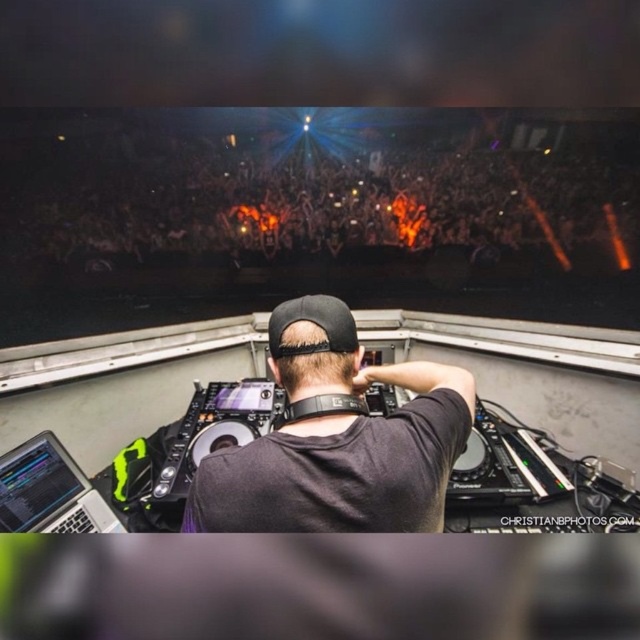
Is black matte shirt at center positioned before silver/black laptop at lower left?

Yes, it is in front of silver/black laptop at lower left.

Who is more forward, (292, 332) or (12, 506)?

Positioned in front is point (292, 332).

Between point (292, 486) and point (65, 477), which one is positioned behind?

The point (65, 477) is more distant.

Identify the location of black matte shirt at center. (337, 440).